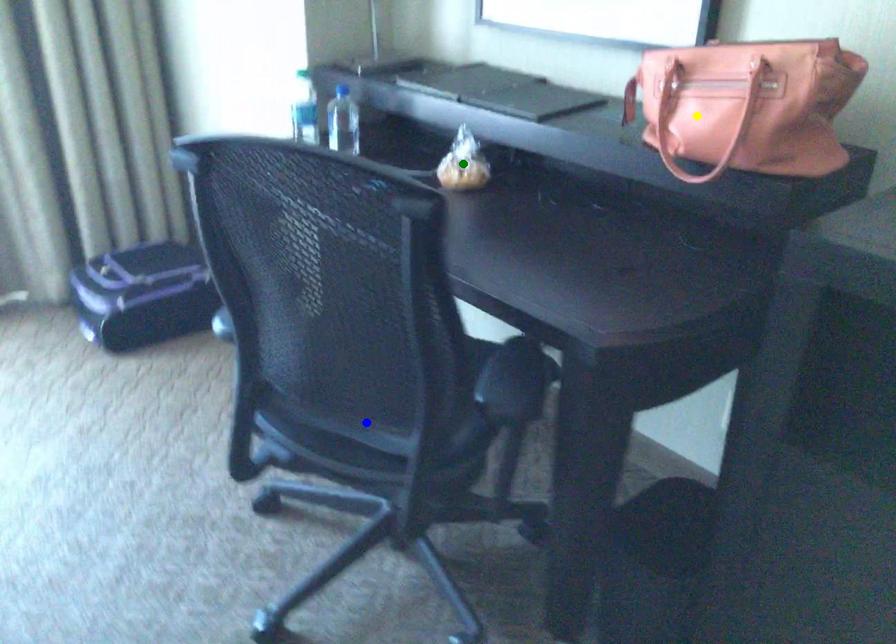
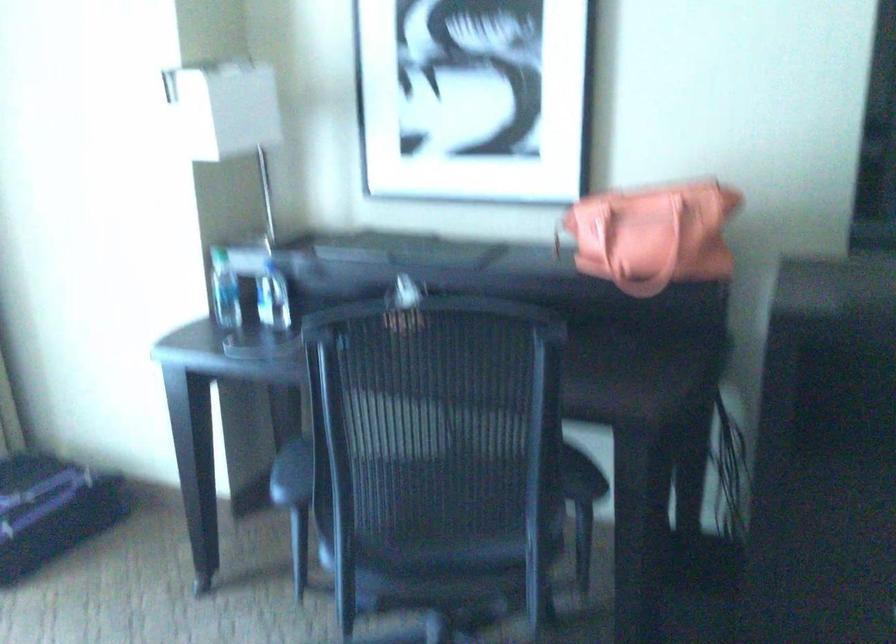
I am providing you with two images of the same scene from different viewpoints. Three points are marked in image1. Which point corresponds to a part or object that is occluded in image2?In image1, three points are marked. Which of them correspond to a part or object that is occluded in image2?Among the three points shown in image1, which one corresponds to a part or object that is no longer visible due to occlusion in image2?

green point